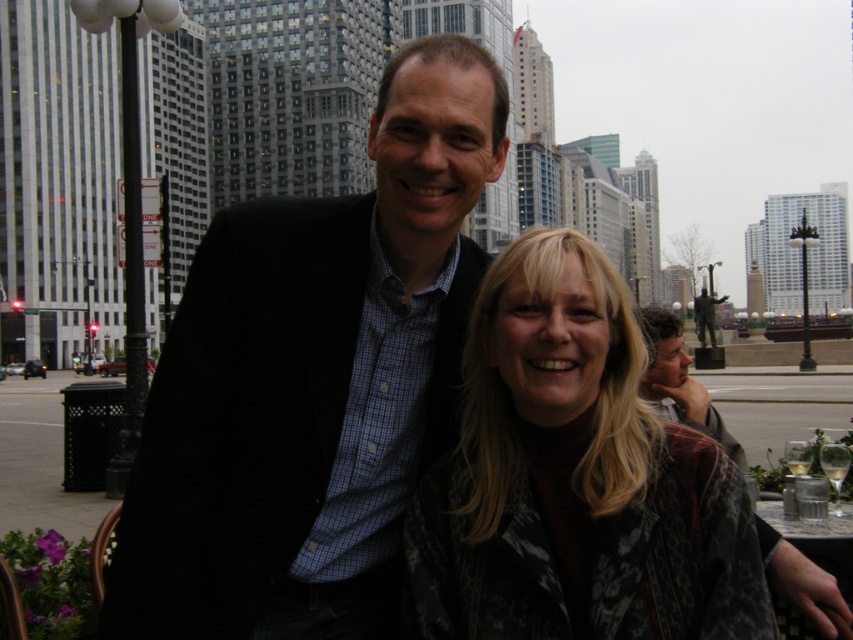
You are a fashion designer observing two jackets in the image. The patterned fabric jacket at center and the matte black jacket at center. Which jacket is positioned lower on the person?

The patterned fabric jacket at center is below the matte black jacket at center, so the patterned fabric jacket at center is positioned lower.

You are a photographer trying to capture a closeup shot of the patterned fabric jacket at center and the matte black jacket at center. Which jacket should you focus on first to ensure it appears clearer in the photo?

The patterned fabric jacket at center is closer to the viewer than the matte black jacket at center, so focusing on the patterned fabric jacket at center first will ensure it appears clearer in the photo.